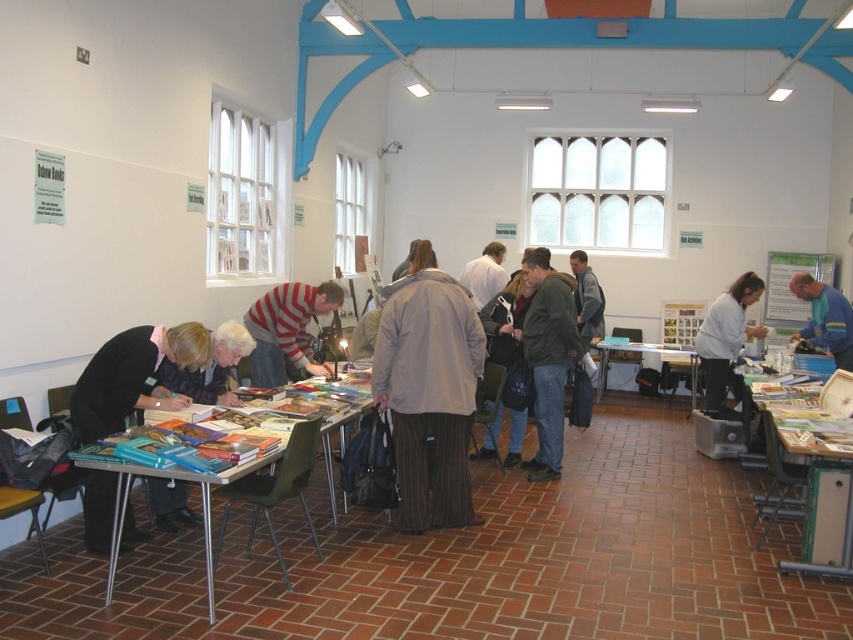
Question: Which is nearer to the wooden table at lower left?

Choices:
 (A) black fabric at lower left
 (B) metallic silver table at center
 (C) light beige jacket at center
 (D) smooth beige coat at center

Answer: (C)

Question: Among these objects, which one is farthest from the camera?

Choices:
 (A) striped shirt at center
 (B) white fabric jacket at center

Answer: (B)

Question: Is dark gray jacket at center to the right of smooth beige coat at center from the viewer's perspective?

Choices:
 (A) no
 (B) yes

Answer: (B)

Question: Is striped shirt at center in front of white matte jacket at lower right?

Choices:
 (A) no
 (B) yes

Answer: (B)

Question: Estimate the real-world distances between objects in this image. Which object is farther from the wooden table at lower right?

Choices:
 (A) blue fabric shirt at right
 (B) wooden table at lower left

Answer: (B)

Question: Observing the image, what is the correct spatial positioning of black fabric at lower left in reference to white fabric jacket at center?

Choices:
 (A) right
 (B) left

Answer: (B)